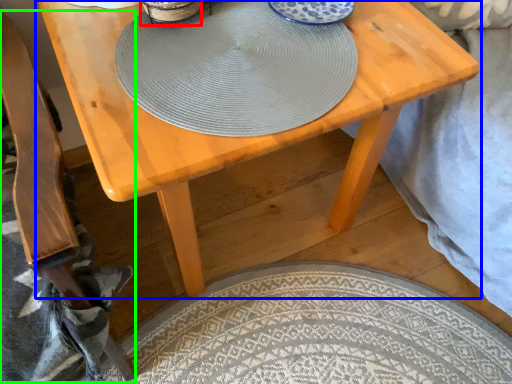
Question: Based on their relative distances, which object is nearer to tableware (highlighted by a red box)? Choose from table (highlighted by a blue box) and armchair (highlighted by a green box).

Choices:
 (A) table
 (B) armchair

Answer: (B)